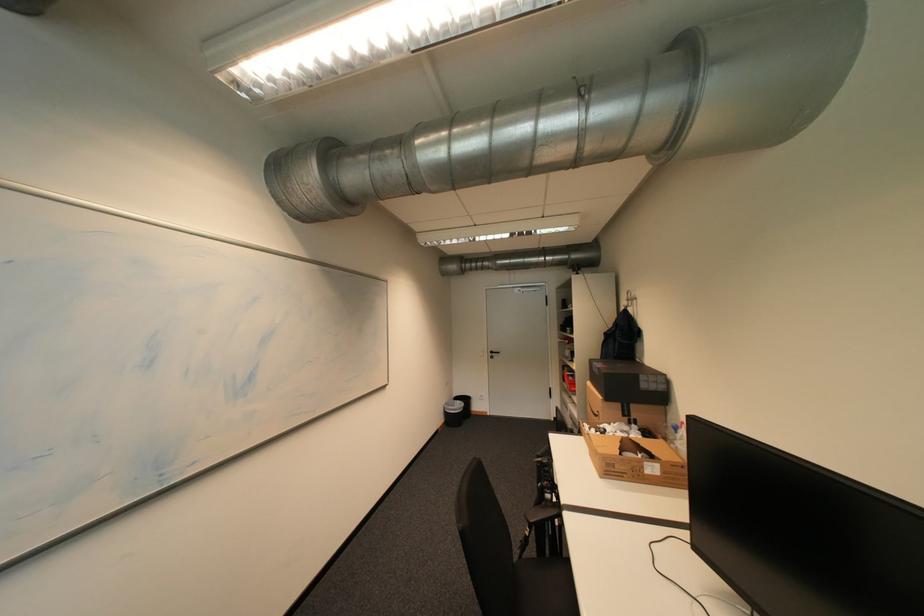
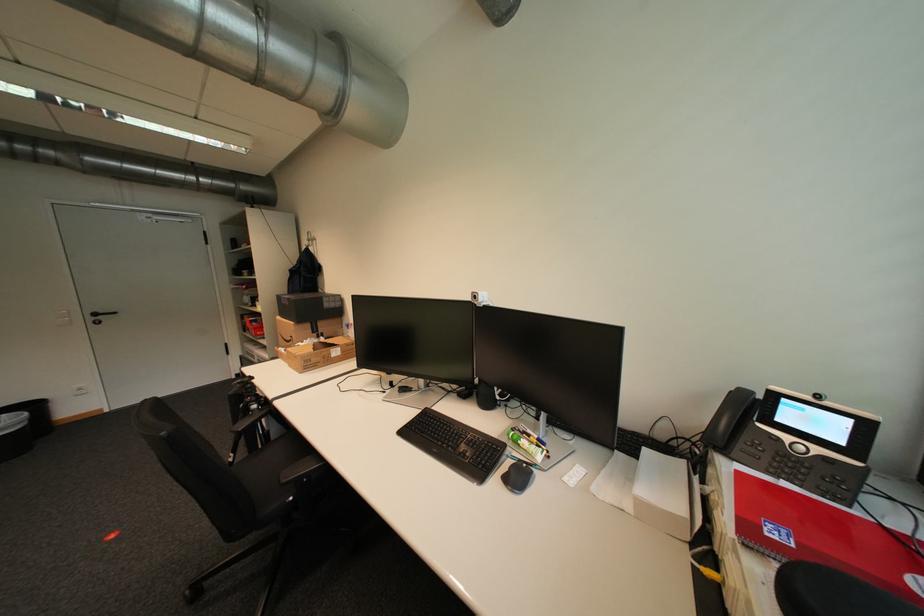
Where in the second image is the point corresponding to (x=606, y=411) from the first image?

(299, 338)